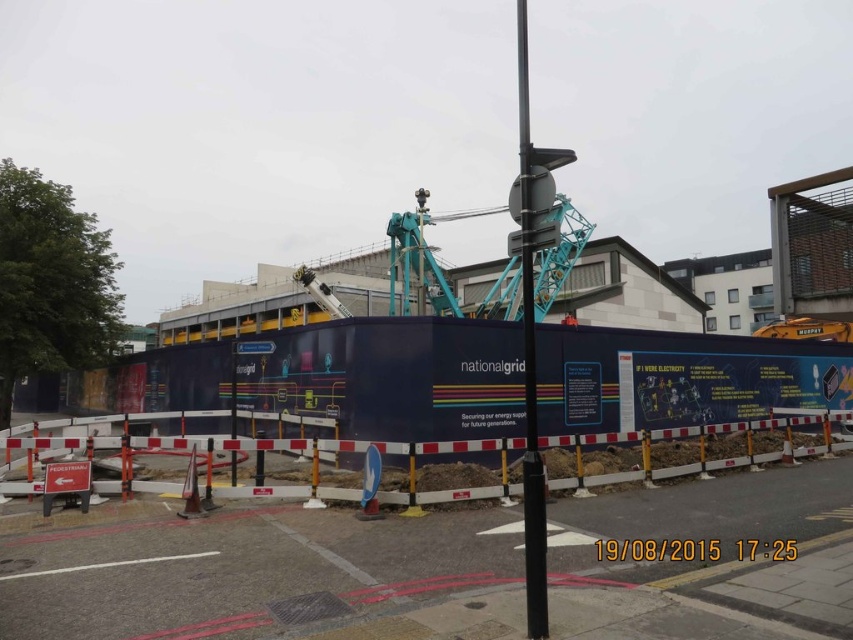
Question: Which point is farther from the camera taking this photo?

Choices:
 (A) (537, 476)
 (B) (274, 348)

Answer: (B)

Question: Which of the following is the farthest from the observer?

Choices:
 (A) (265, 496)
 (B) (260, 342)

Answer: (B)

Question: Is white plastic barrier at lower center below black metal pole at center?

Choices:
 (A) no
 (B) yes

Answer: (B)

Question: Can you confirm if dark blue painted wall at center is bigger than black metal pole at center?

Choices:
 (A) no
 (B) yes

Answer: (A)

Question: Is dark blue painted wall at center positioned at the back of black metal pole at center?

Choices:
 (A) no
 (B) yes

Answer: (B)

Question: Which is farther from the white plastic sign at center?

Choices:
 (A) orange fabric construction worker at center
 (B) blue/white construction barrier at center

Answer: (A)